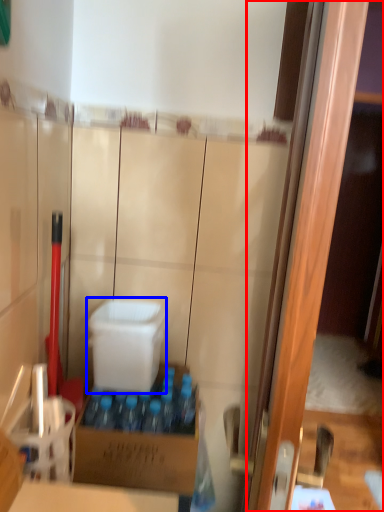
Question: Which object is further to the camera taking this photo, screen door (highlighted by a red box) or box (highlighted by a blue box)?

Choices:
 (A) screen door
 (B) box

Answer: (B)